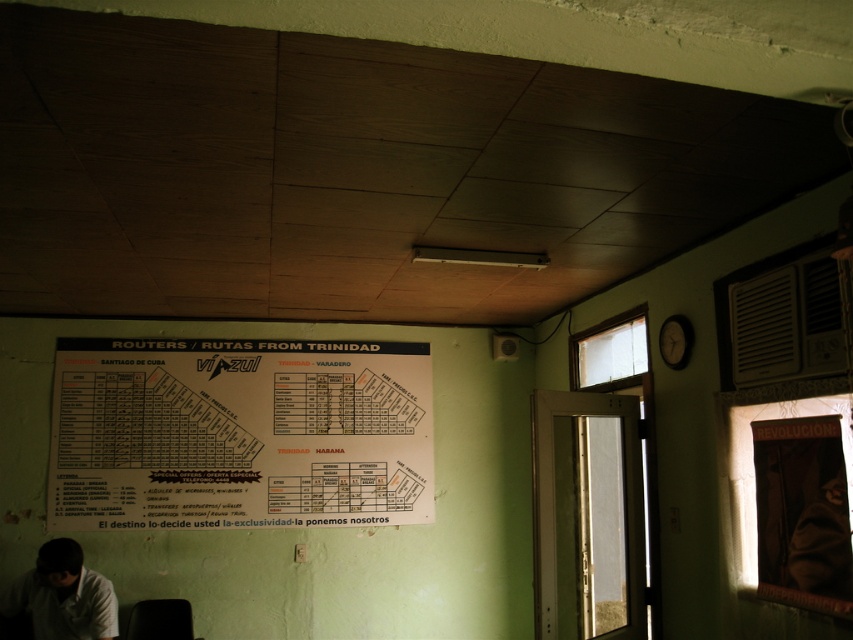
Question: Can you confirm if white paper poster at center is smaller than white matte shirt at lower left?

Choices:
 (A) no
 (B) yes

Answer: (A)

Question: Is white paper poster at center positioned at the back of white matte shirt at lower left?

Choices:
 (A) yes
 (B) no

Answer: (A)

Question: Which point is closer to the camera?

Choices:
 (A) (218, 378)
 (B) (65, 570)

Answer: (B)

Question: Which object is closer to the camera taking this photo?

Choices:
 (A) white matte shirt at lower left
 (B) white paper poster at center

Answer: (A)

Question: From the image, what is the correct spatial relationship of white paper poster at center in relation to white matte shirt at lower left?

Choices:
 (A) below
 (B) above

Answer: (B)